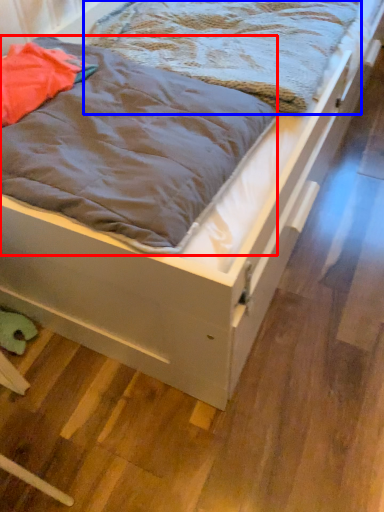
Question: Which object appears closest to the camera in this image, blanket (highlighted by a red box) or blanket (highlighted by a blue box)?

Choices:
 (A) blanket
 (B) blanket

Answer: (A)